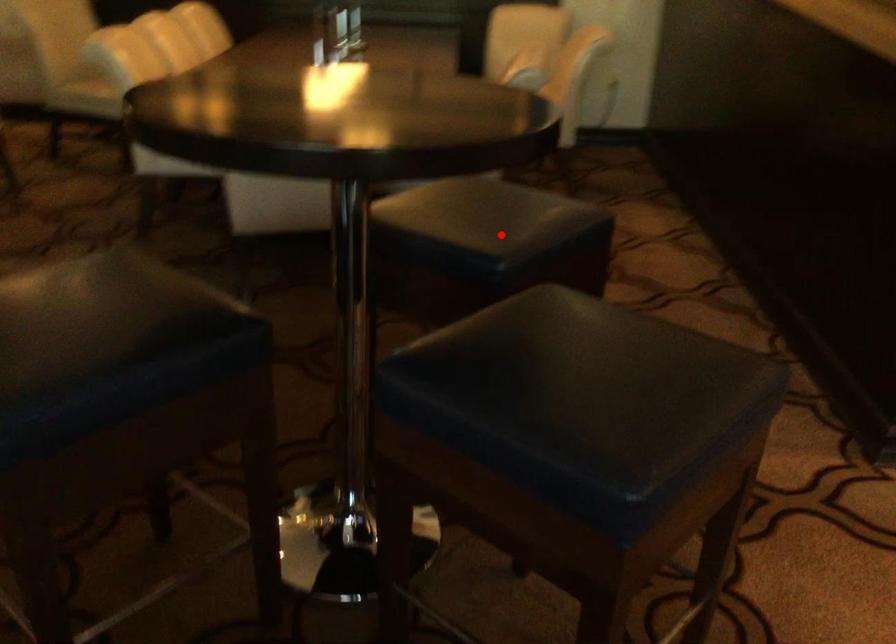
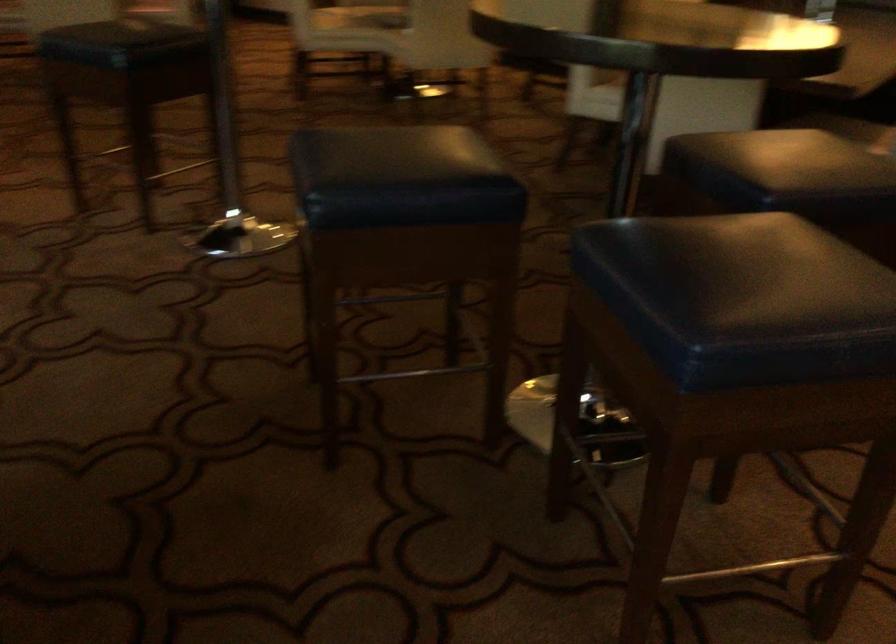
In the second image, find the point that corresponds to the highlighted location in the first image.

(778, 167)